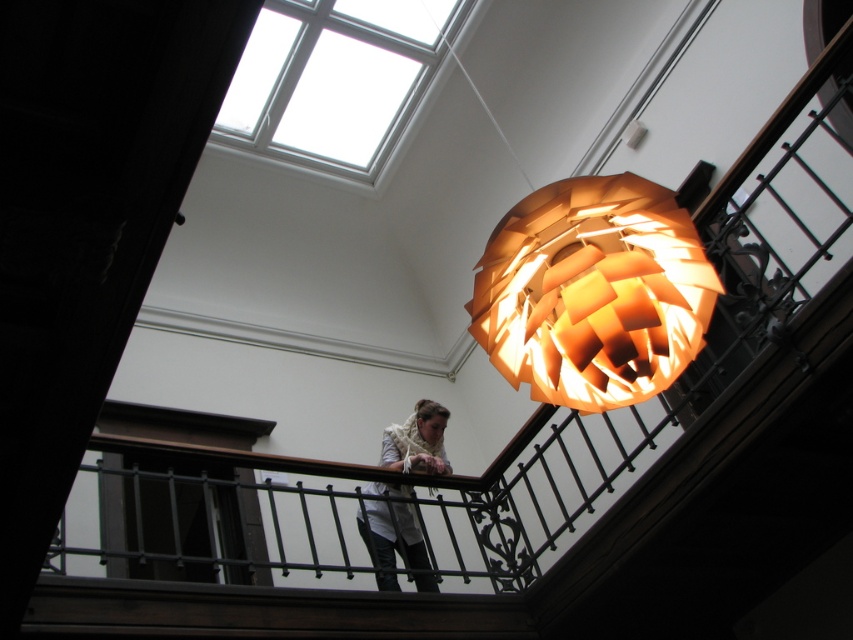
Between matte orange paper lampshade at upper center and white fabric at center, which one is positioned lower?

white fabric at center is lower down.

Can you confirm if matte orange paper lampshade at upper center is bigger than white fabric at center?

Incorrect, matte orange paper lampshade at upper center is not larger than white fabric at center.

Who is more distant from viewer, (579, 346) or (418, 452)?

Positioned behind is point (418, 452).

I want to click on matte orange paper lampshade at upper center, so click(x=593, y=292).